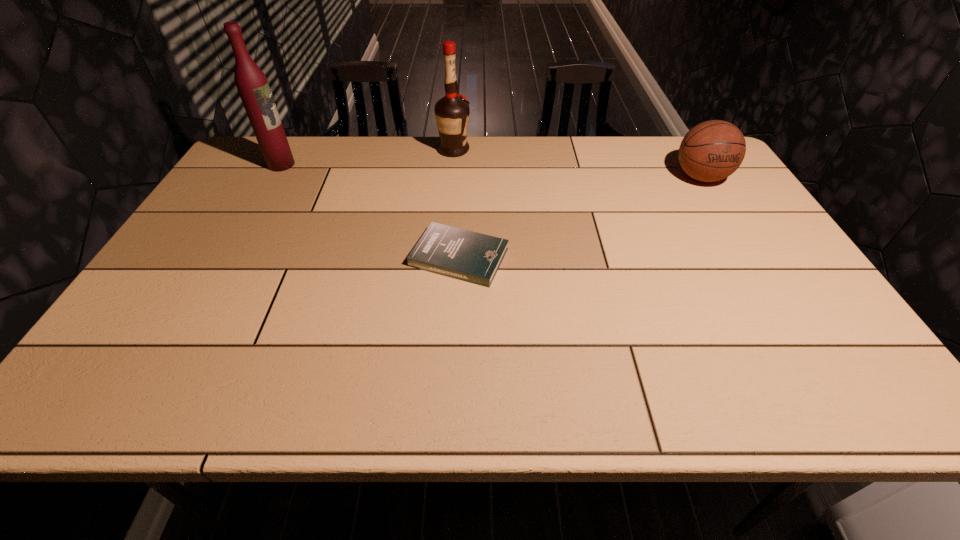
This screenshot has width=960, height=540. Find the location of `the tallest object`. the tallest object is located at coordinates (253, 87).

The width and height of the screenshot is (960, 540). What are the coordinates of `the taller liquor` in the screenshot? It's located at (253, 87).

Find the location of `the right liquor`. the right liquor is located at coordinates (452, 111).

Find the location of `the third shortest object`. the third shortest object is located at coordinates (452, 111).

The width and height of the screenshot is (960, 540). What are the coordinates of `basketball` in the screenshot? It's located at (711, 151).

Where is `the second shortest object`? the second shortest object is located at coordinates (711, 151).

Where is `book`? book is located at coordinates (461, 254).

You are a GUI agent. You are given a task and a screenshot of the screen. Output one action in this format:
    pyautogui.click(x=<x>, y=<y>)
    Task: Click on the nearest object
    The height and width of the screenshot is (540, 960).
    Given the screenshot: What is the action you would take?
    [x=461, y=254]

Where is `free space located 0.160m on the label of the leftmost object`? This screenshot has height=540, width=960. free space located 0.160m on the label of the leftmost object is located at coordinates (344, 165).

The height and width of the screenshot is (540, 960). What are the coordinates of `vacant space situated on the front and back of the third shortest object` in the screenshot? It's located at (497, 150).